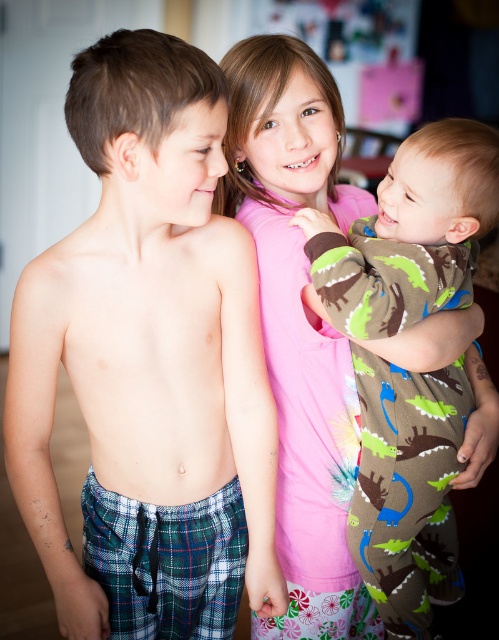
Question: Is the position of brown fleece onesie at right less distant than that of pink fabric at center?

Choices:
 (A) no
 (B) yes

Answer: (B)

Question: Considering the real-world distances, which object is closest to the brown fleece onesie at right?

Choices:
 (A) plaid fabric pants at left
 (B) pink fabric at center

Answer: (B)

Question: Among these points, which one is farthest from the camera?

Choices:
 (A) (455, 156)
 (B) (170, 372)

Answer: (B)

Question: Which object is the closest to the pink fabric at center?

Choices:
 (A) plaid fabric pants at left
 (B) brown fleece onesie at right

Answer: (B)

Question: Is plaid fabric pants at left above brown fleece onesie at right?

Choices:
 (A) yes
 (B) no

Answer: (A)

Question: Does plaid fabric pants at left have a greater width compared to brown fleece onesie at right?

Choices:
 (A) no
 (B) yes

Answer: (B)